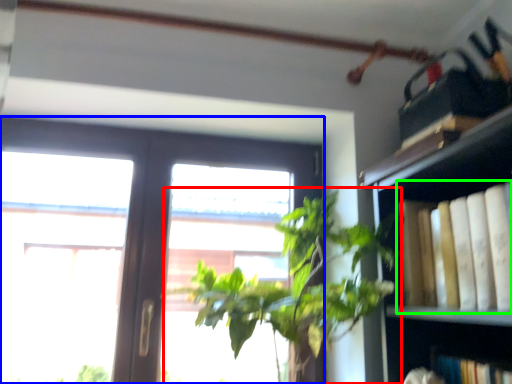
Question: Considering the real-world distances, which object is farthest from houseplant (highlighted by a red box)? window (highlighted by a blue box) or book (highlighted by a green box)?

Choices:
 (A) window
 (B) book

Answer: (A)